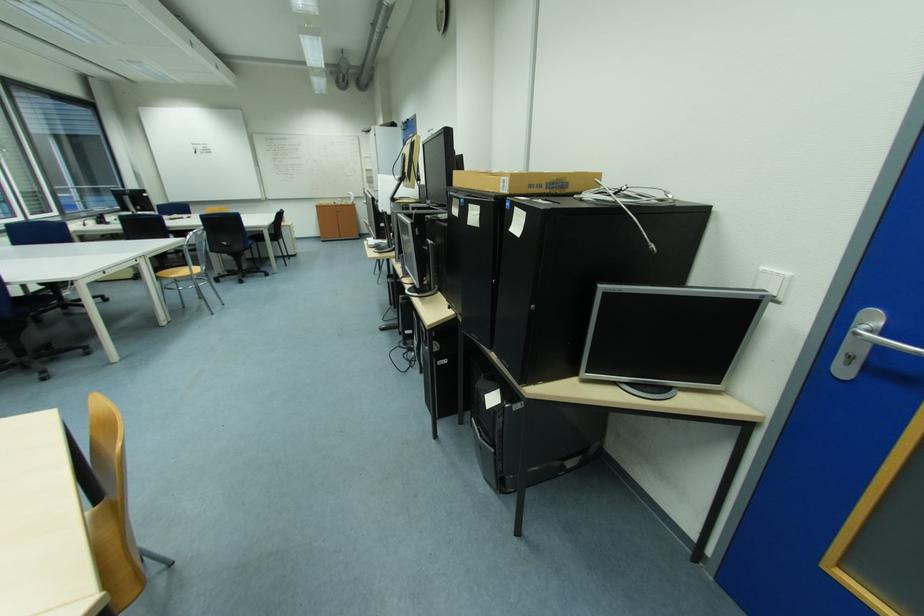
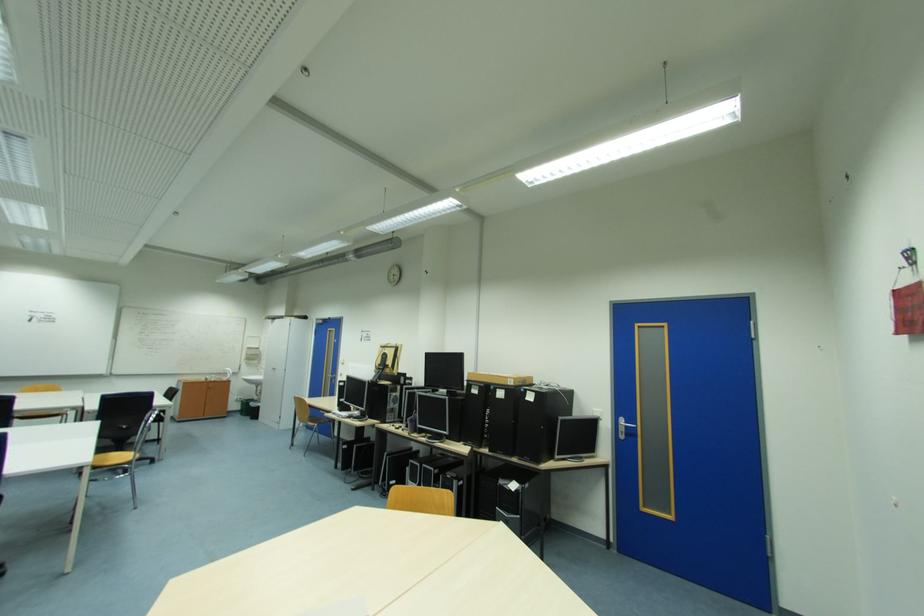
Where in the second image is the point corresponding to (508,185) from the first image?

(517, 382)